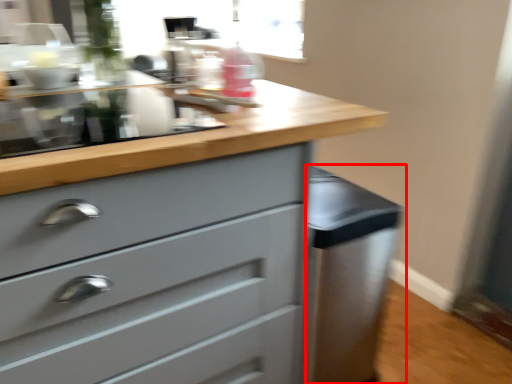
Question: From the image's perspective, where is cabinetry (annotated by the red box) located in relation to chest of drawers in the image?

Choices:
 (A) above
 (B) below

Answer: (B)